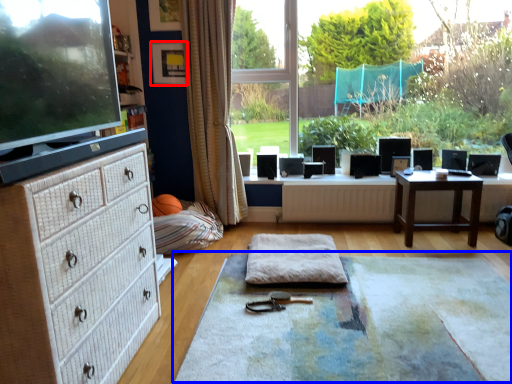
Question: Among these objects, which one is nearest to the camera, picture frame (highlighted by a red box) or yoga mat (highlighted by a blue box)?

Choices:
 (A) picture frame
 (B) yoga mat

Answer: (B)